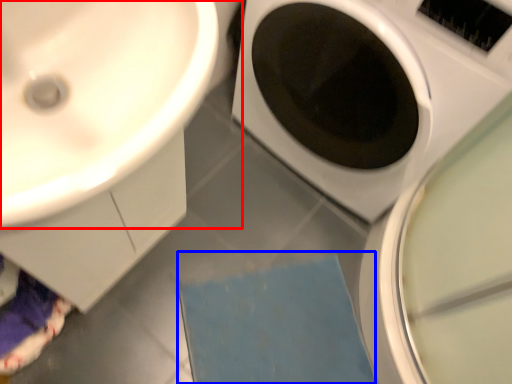
Question: Which object appears closest to the camera in this image, sink (highlighted by a red box) or bath mat (highlighted by a blue box)?

Choices:
 (A) sink
 (B) bath mat

Answer: (A)